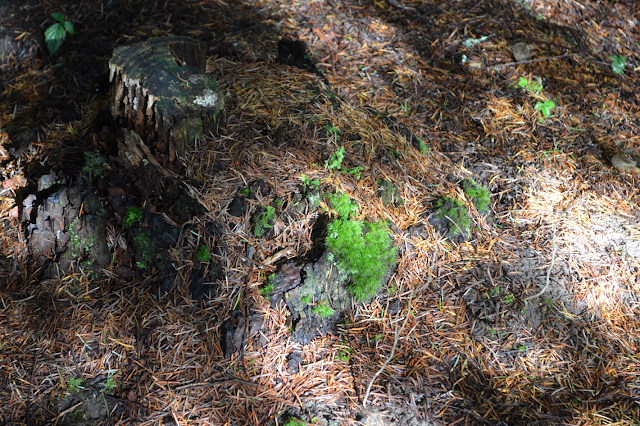
Image resolution: width=640 pixels, height=426 pixels. In order to click on small plants in this screenshot , I will do `click(532, 101)`, `click(527, 79)`, `click(616, 63)`.